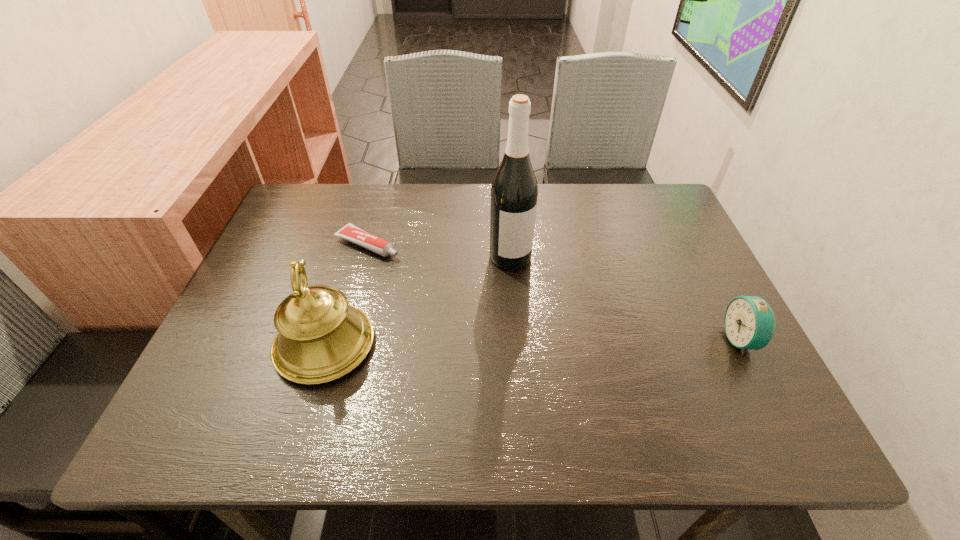
Identify which object is located as the second nearest to the shortest object. Please provide its 2D coordinates. Your answer should be formatted as a tuple, i.e. [(x, y)], where the tuple contains the x and y coordinates of a point satisfying the conditions above.

[(514, 192)]

The width and height of the screenshot is (960, 540). What are the coordinates of `object identified as the second closest to the alarm clock` in the screenshot? It's located at (320, 338).

Where is `free point that satisfies the following two spatial constraints: 1. on the front side of the rightmost object; 2. on the front-facing side of the toothpaste`? The width and height of the screenshot is (960, 540). free point that satisfies the following two spatial constraints: 1. on the front side of the rightmost object; 2. on the front-facing side of the toothpaste is located at coordinates (342, 340).

Find the location of `vacant region that satisfies the following two spatial constraints: 1. on the back side of the second object from right to left; 2. on the right side of the second tallest object`. vacant region that satisfies the following two spatial constraints: 1. on the back side of the second object from right to left; 2. on the right side of the second tallest object is located at coordinates (351, 257).